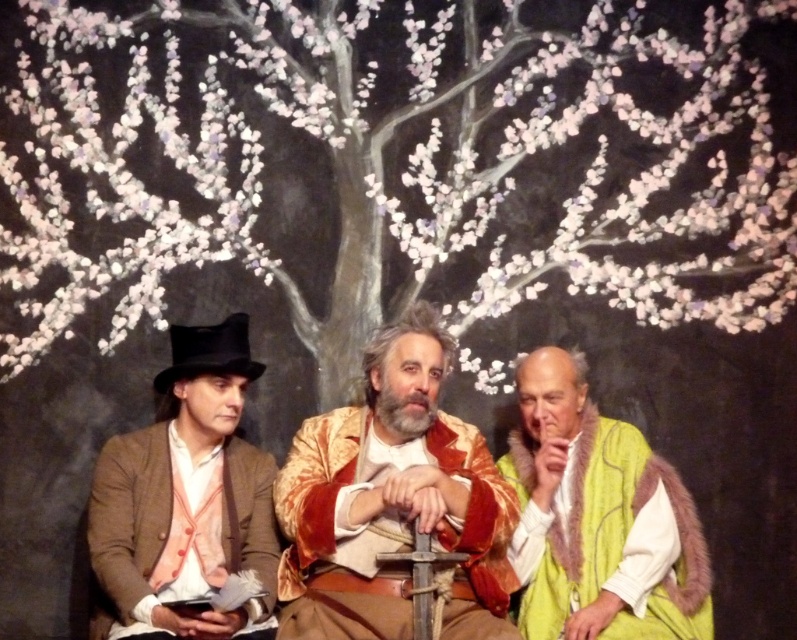
You are standing in front of the scene and want to place a small decorative item between the white textured tree at center and the matte brown coat at left. Based on their positions, where should you place the item?

The white textured tree at center is located above the matte brown coat at left, so you should place the item between them by positioning it below the white textured tree at center and above the matte brown coat at left.

Looking at this image, you are standing in front of the three people in the image. Which of the two, the velvet gold jacket at center or the green fur vest at right, would appear larger to you?

The velvet gold jacket at center would appear larger because it is closer to the viewer than the green fur vest at right.

You are an artist sketching the scene and want to ensure the proportions are accurate. Which of the two figures, the velvet gold jacket at center or the matte brown coat at left, should you draw taller in your sketch?

The velvet gold jacket at center should be drawn taller because it is taller than the matte brown coat at left according to the description.